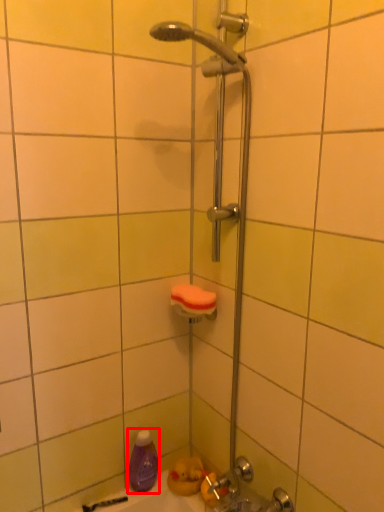
Question: From the image's perspective, where is cleaning product (annotated by the red box) located relative to towel bar?

Choices:
 (A) below
 (B) above

Answer: (A)